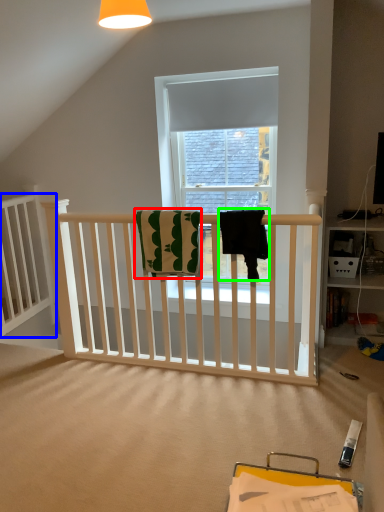
Question: Which is nearer to the beach towel (highlighted by a red box)? bed frame (highlighted by a blue box) or beach towel (highlighted by a green box).

Choices:
 (A) bed frame
 (B) beach towel

Answer: (B)